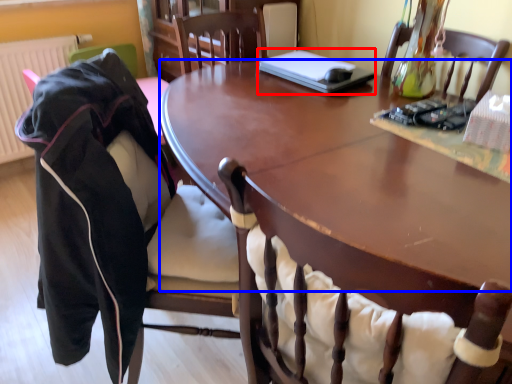
Question: Which object is further to the camera taking this photo, laptop (highlighted by a red box) or table top (highlighted by a blue box)?

Choices:
 (A) laptop
 (B) table top

Answer: (A)